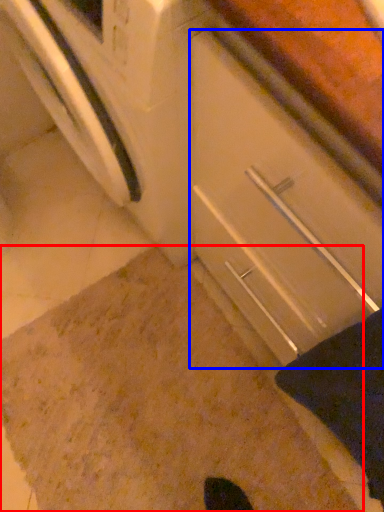
Question: Which of the following is the closest to the observer, granite (highlighted by a red box) or drawer (highlighted by a blue box)?

Choices:
 (A) granite
 (B) drawer

Answer: (B)